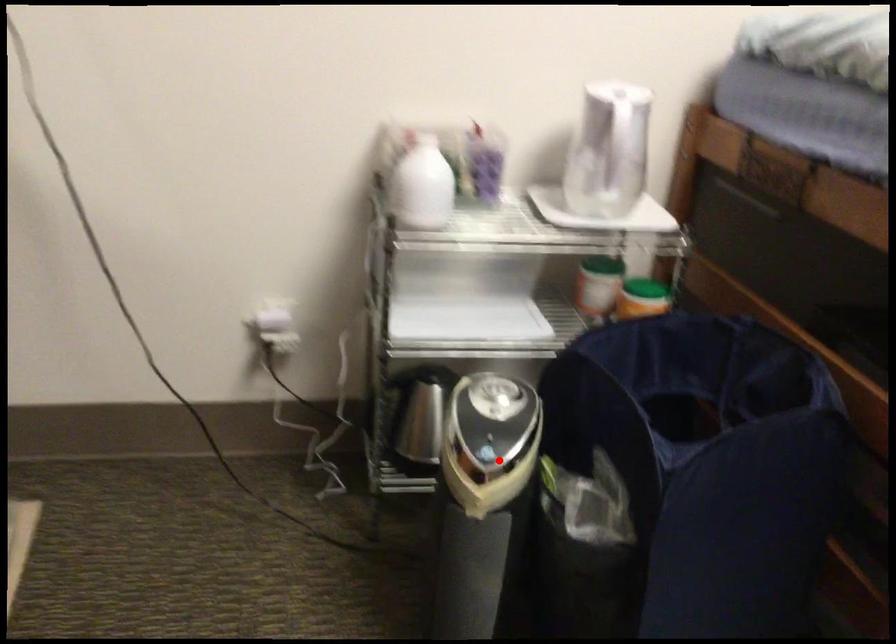
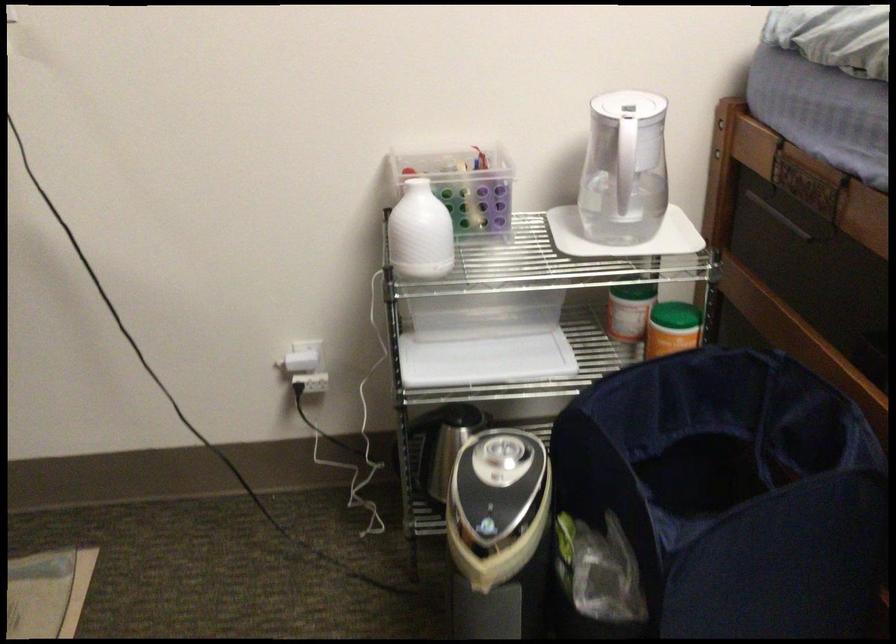
Locate, in the second image, the point that corresponds to the highlighted location in the first image.

(498, 534)